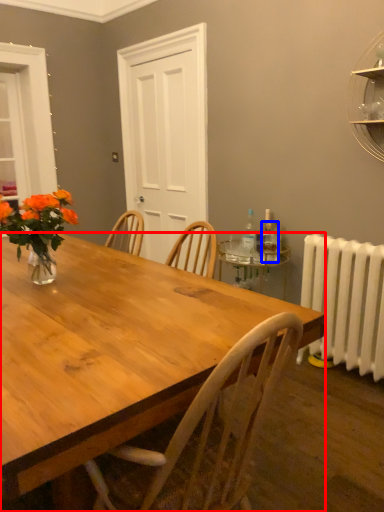
Question: Which of the following is the closest to the observer, desk (highlighted by a red box) or bottle (highlighted by a blue box)?

Choices:
 (A) desk
 (B) bottle

Answer: (A)